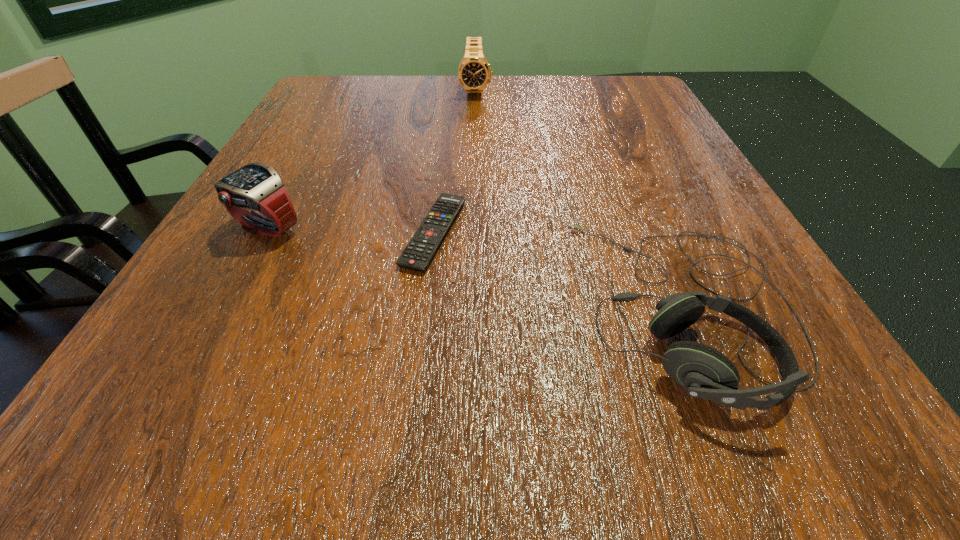
The image size is (960, 540). I want to click on free region at the far left corner of the desktop, so click(x=352, y=93).

Identify the location of vacant space at the near left corner of the desktop. The width and height of the screenshot is (960, 540). (173, 393).

Find the location of a particular element. blank space at the far right corner of the desktop is located at coordinates (611, 77).

Locate an element on the screen. The height and width of the screenshot is (540, 960). free region at the near right corner of the desktop is located at coordinates (784, 411).

Find the location of a particular element. empty space between the rightmost object and the farther watch is located at coordinates (581, 199).

The width and height of the screenshot is (960, 540). In order to click on free space between the rightmost object and the remote control in this screenshot , I will do `click(560, 269)`.

Where is `empty location between the shorter watch and the rightmost object`? empty location between the shorter watch and the rightmost object is located at coordinates (476, 267).

Where is `empty space between the farthest object and the nearer watch`? This screenshot has height=540, width=960. empty space between the farthest object and the nearer watch is located at coordinates (372, 160).

This screenshot has height=540, width=960. I want to click on empty space between the nearer watch and the rightmost object, so click(x=476, y=267).

This screenshot has width=960, height=540. In order to click on free space between the headset and the remote control in this screenshot , I will do point(560,269).